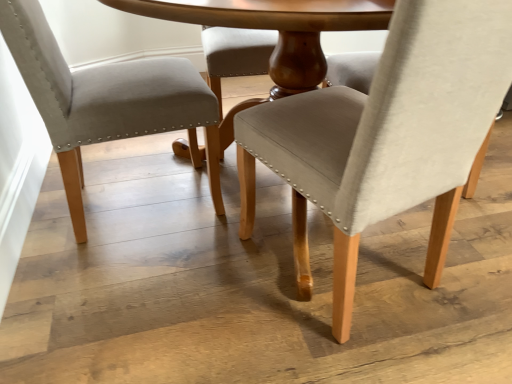
Identify the location of beige fabric chair at left, the first chair positioned from the left. (106, 101).

This screenshot has height=384, width=512. What do you see at coordinates (106, 101) in the screenshot?
I see `beige fabric chair at left, the first chair positioned from the left` at bounding box center [106, 101].

How much space does matte beige fabric chair at center, which is counted as the 2th chair, starting from the left, occupy vertically?

matte beige fabric chair at center, which is counted as the 2th chair, starting from the left, is 82.11 centimeters in height.

I want to click on matte beige fabric chair at center, marked as the 1th chair in a right-to-left arrangement, so click(x=386, y=136).

The width and height of the screenshot is (512, 384). Describe the element at coordinates (386, 136) in the screenshot. I see `matte beige fabric chair at center, which is counted as the 2th chair, starting from the left` at that location.

You are a GUI agent. You are given a task and a screenshot of the screen. Output one action in this format:
    pyautogui.click(x=<x>, y=<y>)
    Task: Click on the beige fabric chair at left, the first chair positioned from the left
    The height and width of the screenshot is (384, 512).
    Given the screenshot: What is the action you would take?
    pyautogui.click(x=106, y=101)

Which is more to the right, beige fabric chair at left, the first chair positioned from the left, or matte beige fabric chair at center, which is counted as the 2th chair, starting from the left?

matte beige fabric chair at center, which is counted as the 2th chair, starting from the left, is more to the right.

Considering their positions, is beige fabric chair at left, the first chair positioned from the left, located in front of or behind matte beige fabric chair at center, marked as the 1th chair in a right-to-left arrangement?

beige fabric chair at left, the first chair positioned from the left, is behind matte beige fabric chair at center, marked as the 1th chair in a right-to-left arrangement.

Which is closer, (66, 95) or (387, 144)?

The point (387, 144) is more forward.

From the image's perspective, which is below, beige fabric chair at left, which is the 2th chair from right to left, or matte beige fabric chair at center, which is counted as the 2th chair, starting from the left?

matte beige fabric chair at center, which is counted as the 2th chair, starting from the left, from the image's perspective.

From a real-world perspective, between beige fabric chair at left, which is the 2th chair from right to left, and matte beige fabric chair at center, marked as the 1th chair in a right-to-left arrangement, who is vertically higher?

In real-world perspective, matte beige fabric chair at center, marked as the 1th chair in a right-to-left arrangement, is above.

Which of these two, beige fabric chair at left, the first chair positioned from the left, or matte beige fabric chair at center, marked as the 1th chair in a right-to-left arrangement, is wider?

With larger width is beige fabric chair at left, the first chair positioned from the left.

Can you confirm if beige fabric chair at left, the first chair positioned from the left, is shorter than matte beige fabric chair at center, marked as the 1th chair in a right-to-left arrangement?

Yes.

Looking at the image, does beige fabric chair at left, which is the 2th chair from right to left, seem bigger or smaller compared to matte beige fabric chair at center, marked as the 1th chair in a right-to-left arrangement?

beige fabric chair at left, which is the 2th chair from right to left, is smaller than matte beige fabric chair at center, marked as the 1th chair in a right-to-left arrangement.

Can matte beige fabric chair at center, which is counted as the 2th chair, starting from the left, be found inside beige fabric chair at left, the first chair positioned from the left?

Definitely not — matte beige fabric chair at center, which is counted as the 2th chair, starting from the left, is not inside beige fabric chair at left, the first chair positioned from the left.

Is beige fabric chair at left, the first chair positioned from the left, with matte beige fabric chair at center, which is counted as the 2th chair, starting from the left?

No.

Based on the photo, is beige fabric chair at left, which is the 2th chair from right to left, oriented towards matte beige fabric chair at center, marked as the 1th chair in a right-to-left arrangement?

No, beige fabric chair at left, which is the 2th chair from right to left, is not facing towards matte beige fabric chair at center, marked as the 1th chair in a right-to-left arrangement.

How much distance is there between beige fabric chair at left, which is the 2th chair from right to left, and matte beige fabric chair at center, which is counted as the 2th chair, starting from the left?

beige fabric chair at left, which is the 2th chair from right to left, and matte beige fabric chair at center, which is counted as the 2th chair, starting from the left, are 18.85 inches apart.

Where is `chair that is above the matte beige fabric chair at center, marked as the 1th chair in a right-to-left arrangement (from the image's perspective)`? chair that is above the matte beige fabric chair at center, marked as the 1th chair in a right-to-left arrangement (from the image's perspective) is located at coordinates tap(106, 101).

Which is more to the right, matte beige fabric chair at center, marked as the 1th chair in a right-to-left arrangement, or beige fabric chair at left, the first chair positioned from the left?

Positioned to the right is matte beige fabric chair at center, marked as the 1th chair in a right-to-left arrangement.

Which object is further away from the camera taking this photo, matte beige fabric chair at center, which is counted as the 2th chair, starting from the left, or beige fabric chair at left, the first chair positioned from the left?

beige fabric chair at left, the first chair positioned from the left, is further away from the camera.

Does point (249, 167) lie behind point (31, 91)?

Yes, point (249, 167) is behind point (31, 91).

From the image's perspective, relative to beige fabric chair at left, the first chair positioned from the left, is matte beige fabric chair at center, marked as the 1th chair in a right-to-left arrangement, above or below?

Clearly, from the image's perspective, matte beige fabric chair at center, marked as the 1th chair in a right-to-left arrangement, is below beige fabric chair at left, the first chair positioned from the left.

From a real-world perspective, is matte beige fabric chair at center, which is counted as the 2th chair, starting from the left, positioned above or below beige fabric chair at left, the first chair positioned from the left?

Clearly, from a real-world perspective, matte beige fabric chair at center, which is counted as the 2th chair, starting from the left, is above beige fabric chair at left, the first chair positioned from the left.

Does matte beige fabric chair at center, which is counted as the 2th chair, starting from the left, have a greater width compared to beige fabric chair at left, which is the 2th chair from right to left?

No, matte beige fabric chair at center, which is counted as the 2th chair, starting from the left, is not wider than beige fabric chair at left, which is the 2th chair from right to left.

Who is shorter, matte beige fabric chair at center, marked as the 1th chair in a right-to-left arrangement, or beige fabric chair at left, the first chair positioned from the left?

With less height is beige fabric chair at left, the first chair positioned from the left.

Who is bigger, matte beige fabric chair at center, which is counted as the 2th chair, starting from the left, or beige fabric chair at left, the first chair positioned from the left?

Bigger between the two is matte beige fabric chair at center, which is counted as the 2th chair, starting from the left.

Is beige fabric chair at left, the first chair positioned from the left, located within matte beige fabric chair at center, which is counted as the 2th chair, starting from the left?

No, beige fabric chair at left, the first chair positioned from the left, is not inside matte beige fabric chair at center, which is counted as the 2th chair, starting from the left.

Is matte beige fabric chair at center, which is counted as the 2th chair, starting from the left, far from beige fabric chair at left, which is the 2th chair from right to left?

They are positioned close to each other.

Is matte beige fabric chair at center, marked as the 1th chair in a right-to-left arrangement, facing towards beige fabric chair at left, the first chair positioned from the left?

No, matte beige fabric chair at center, marked as the 1th chair in a right-to-left arrangement, is not aimed at beige fabric chair at left, the first chair positioned from the left.

How many degrees apart are the facing directions of matte beige fabric chair at center, which is counted as the 2th chair, starting from the left, and beige fabric chair at left, which is the 2th chair from right to left?

The angle between the facing direction of matte beige fabric chair at center, which is counted as the 2th chair, starting from the left, and the facing direction of beige fabric chair at left, which is the 2th chair from right to left, is 107 degrees.

Identify the location of chair that is above the beige fabric chair at left, which is the 2th chair from right to left (from a real-world perspective). The image size is (512, 384). (386, 136).

Find the location of a particular element. chair that appears below the beige fabric chair at left, the first chair positioned from the left (from the image's perspective) is located at coordinates (386, 136).

Locate an element on the screen. chair below the matte beige fabric chair at center, marked as the 1th chair in a right-to-left arrangement (from a real-world perspective) is located at coordinates (106, 101).